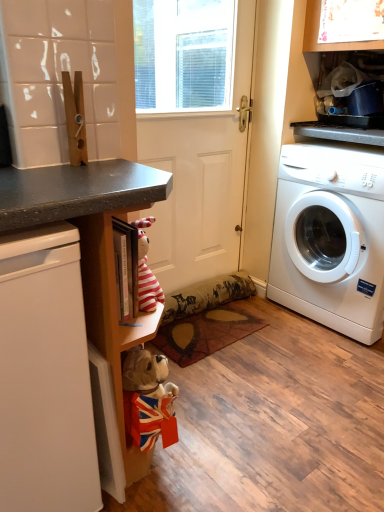
Question: Is patterned fabric mat at center surrounded by white plastic washing machine at right?

Choices:
 (A) no
 (B) yes

Answer: (A)

Question: From a real-world perspective, is white plastic washing machine at right physically above patterned fabric mat at center?

Choices:
 (A) no
 (B) yes

Answer: (B)

Question: Is white plastic washing machine at right placed right next to patterned fabric mat at center?

Choices:
 (A) no
 (B) yes

Answer: (A)

Question: From a real-world perspective, does white plastic washing machine at right sit lower than patterned fabric mat at center?

Choices:
 (A) no
 (B) yes

Answer: (A)

Question: Is white plastic washing machine at right further to camera compared to patterned fabric mat at center?

Choices:
 (A) yes
 (B) no

Answer: (B)

Question: Can you confirm if white plastic washing machine at right is positioned to the right of patterned fabric mat at center?

Choices:
 (A) no
 (B) yes

Answer: (B)

Question: Would you say white matte screen door at center contains white matte dishwasher at left?

Choices:
 (A) yes
 (B) no

Answer: (B)

Question: Can you confirm if white matte screen door at center is shorter than white matte dishwasher at left?

Choices:
 (A) yes
 (B) no

Answer: (B)

Question: Could you tell me if white matte screen door at center is turned towards white matte dishwasher at left?

Choices:
 (A) yes
 (B) no

Answer: (B)

Question: Is white matte screen door at center directly adjacent to white matte dishwasher at left?

Choices:
 (A) yes
 (B) no

Answer: (B)

Question: Does white matte screen door at center have a smaller size compared to white matte dishwasher at left?

Choices:
 (A) yes
 (B) no

Answer: (A)

Question: From the image's perspective, is white matte screen door at center located beneath white matte dishwasher at left?

Choices:
 (A) yes
 (B) no

Answer: (B)

Question: Is white matte dishwasher at left smaller than white plastic washing machine at right?

Choices:
 (A) no
 (B) yes

Answer: (B)